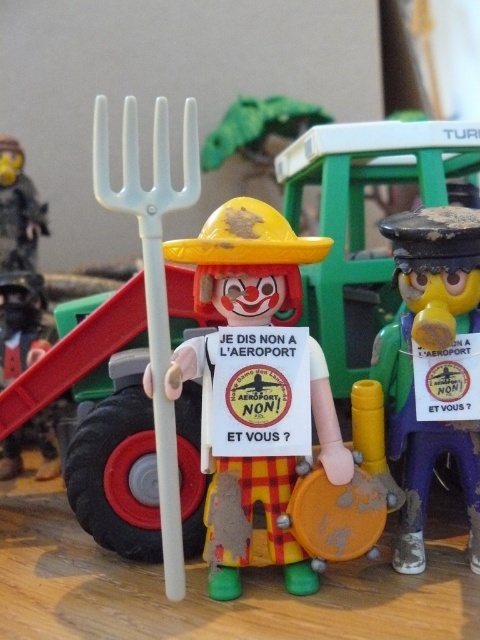
Question: Based on their relative distances, which object is farther from the brushed metal figure at left?

Choices:
 (A) matte black sign at right
 (B) brushed metal fork at upper left

Answer: (A)

Question: Is brushed metal figure at left positioned behind brushed metal fork at upper left?

Choices:
 (A) no
 (B) yes

Answer: (A)

Question: Is matte black sign at right to the left of brushed metal figure at left from the viewer's perspective?

Choices:
 (A) no
 (B) yes

Answer: (A)

Question: Does matte plastic clown at center appear on the right side of brushed metal fork at upper left?

Choices:
 (A) yes
 (B) no

Answer: (A)

Question: Estimate the real-world distances between objects in this image. Which object is closer to the matte plastic clown at center?

Choices:
 (A) matte black sign at right
 (B) brushed metal figure at left

Answer: (A)

Question: Estimate the real-world distances between objects in this image. Which object is closer to the brushed metal fork at upper left?

Choices:
 (A) matte black sign at right
 (B) brushed metal figure at left
 (C) matte plastic clown at center

Answer: (B)